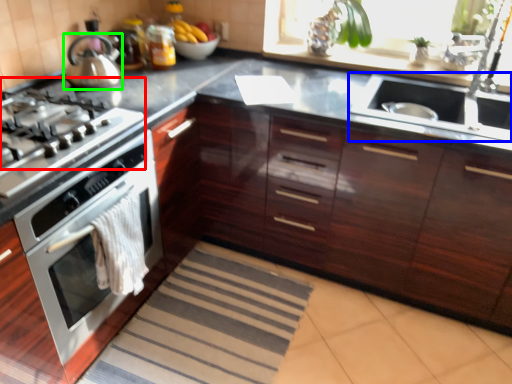
Question: Based on their relative distances, which object is nearer to gas stove (highlighted by a red box)? Choose from sink (highlighted by a blue box) and kitchen appliance (highlighted by a green box).

Choices:
 (A) sink
 (B) kitchen appliance

Answer: (B)